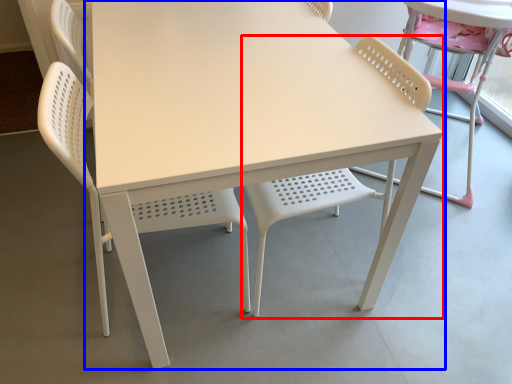
Question: Which object appears farthest to the camera in this image, chair (highlighted by a red box) or table (highlighted by a blue box)?

Choices:
 (A) chair
 (B) table

Answer: (B)